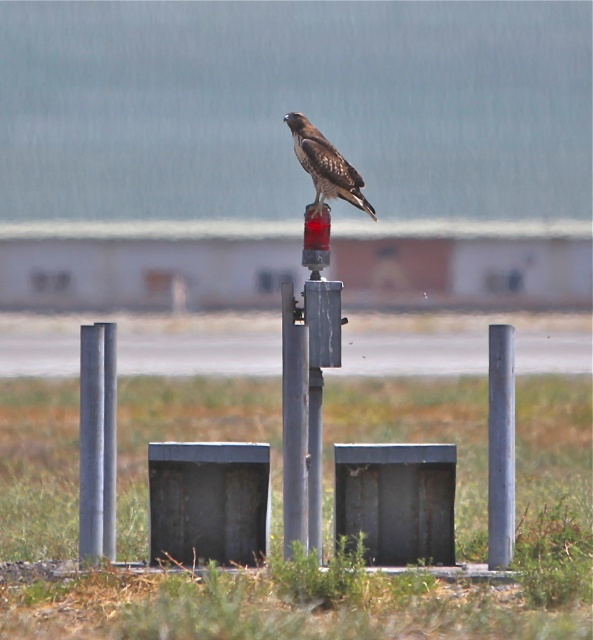
Question: Among these objects, which one is nearest to the camera?

Choices:
 (A) brown speckled feathers at center
 (B) metallic gray post at left
 (C) silver metallic post at center-right

Answer: (B)

Question: Can you confirm if metallic gray post at left is bigger than brown speckled feathers at center?

Choices:
 (A) no
 (B) yes

Answer: (A)

Question: Is metallic gray post at left smaller than brown speckled feathers at center?

Choices:
 (A) yes
 (B) no

Answer: (A)

Question: Estimate the real-world distances between objects in this image. Which object is farther from the brown speckled feathers at center?

Choices:
 (A) metallic gray post at left
 (B) silver metallic post at center-right

Answer: (A)

Question: Does metallic gray post at left have a greater width compared to silver metallic post at center-right?

Choices:
 (A) no
 (B) yes

Answer: (B)

Question: Which point is farther from the camera taking this photo?

Choices:
 (A) (511, 356)
 (B) (81, 456)

Answer: (B)